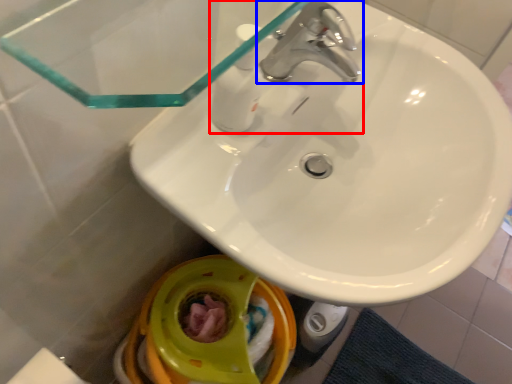
Question: Which object is further to the camera taking this photo, tap (highlighted by a red box) or tap (highlighted by a blue box)?

Choices:
 (A) tap
 (B) tap

Answer: (B)